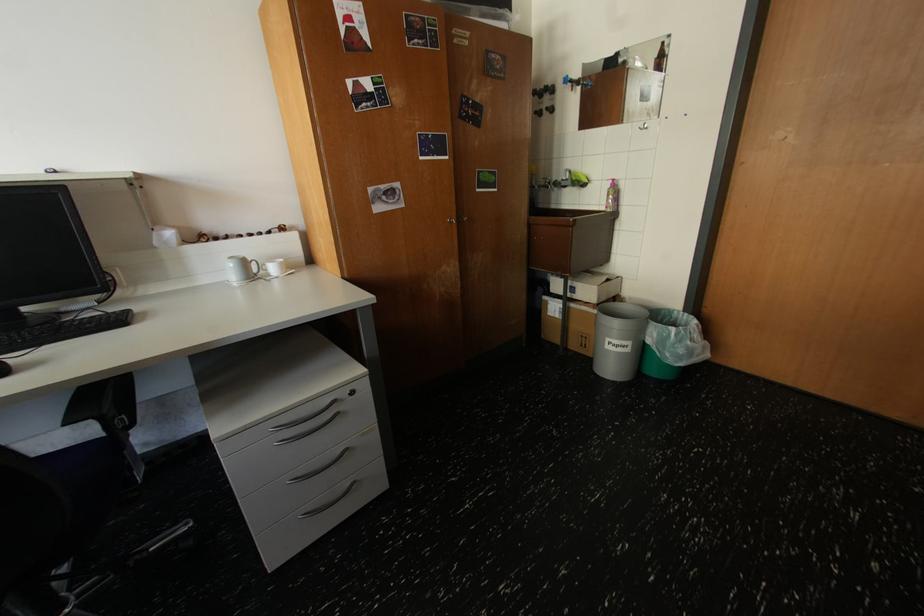
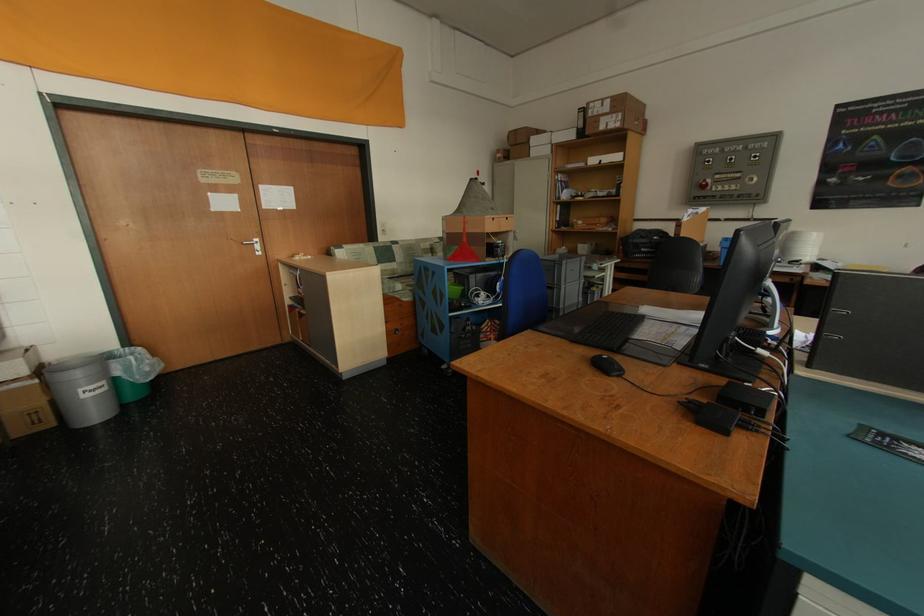
Where in the second image is the point corresponding to (624,347) from the first image?

(101, 392)